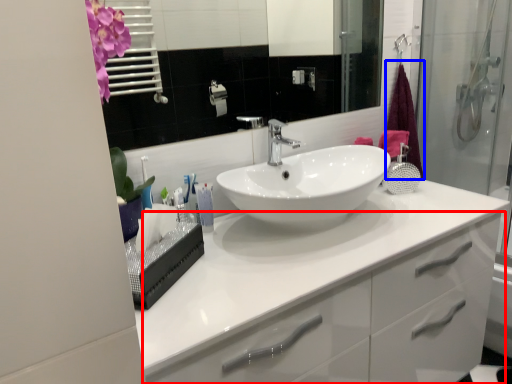
Question: Which of the following is the closest to the observer, bathroom cabinet (highlighted by a red box) or shower curtain (highlighted by a blue box)?

Choices:
 (A) bathroom cabinet
 (B) shower curtain

Answer: (A)